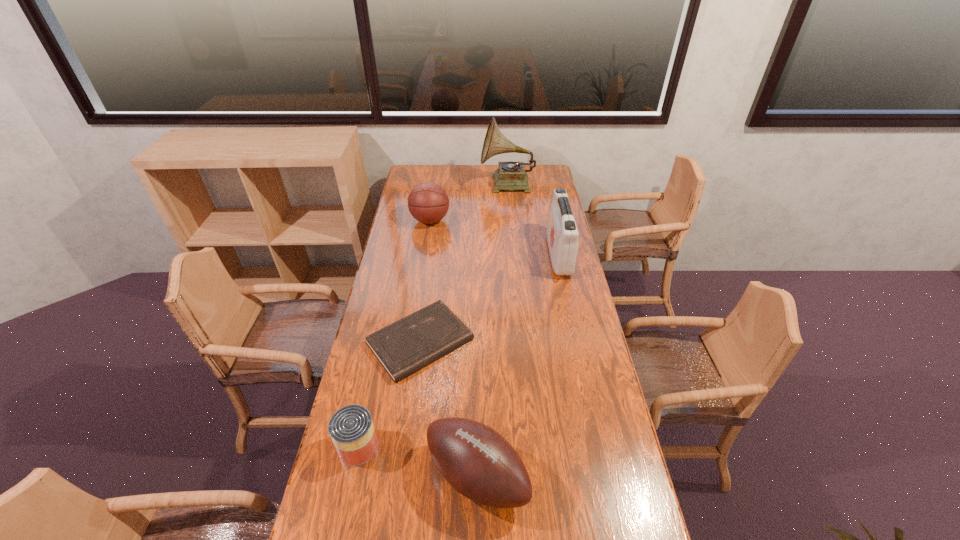
At what (x,y) coordinates should I click in order to perform the action: click on vacant space situated from the horn of the farthest object. Please return your answer as a coordinate pair (x, y). Looking at the image, I should click on (442, 185).

In order to click on vacant space located 0.220m from the horn of the farthest object in this screenshot , I will do `click(442, 185)`.

Identify the location of free space located 0.400m on the front side of the second tallest object. This screenshot has width=960, height=540. (461, 255).

Locate an element on the screen. This screenshot has width=960, height=540. free space located 0.170m on the front side of the second tallest object is located at coordinates (512, 255).

Identify the location of vacant space located on the front side of the second tallest object. (494, 255).

Locate an element on the screen. Image resolution: width=960 pixels, height=540 pixels. vacant space located 0.050m on the right of the fifth nearest object is located at coordinates (460, 220).

What are the coordinates of `free location located 0.270m on the right of the football (American)` in the screenshot? It's located at (624, 476).

What are the coordinates of `vacant space located on the front of the can` in the screenshot? It's located at (342, 522).

Where is `free space located 0.390m on the front of the fourth farthest object`? The width and height of the screenshot is (960, 540). free space located 0.390m on the front of the fourth farthest object is located at coordinates (398, 507).

What are the coordinates of `object situated at the far edge` in the screenshot? It's located at (511, 175).